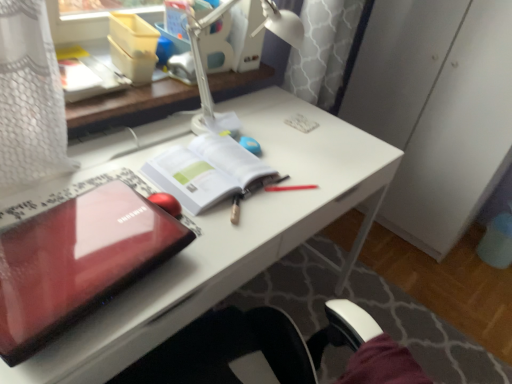
Where is `free spot below white plastic lamp at upper center (from a real-world perspective)`? free spot below white plastic lamp at upper center (from a real-world perspective) is located at coordinates (246, 126).